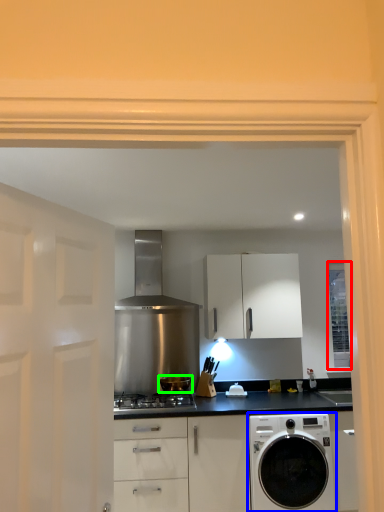
Question: Based on their relative distances, which object is farther from window (highlighted by a red box)? Choose from washing machine (highlighted by a blue box) and kitchen appliance (highlighted by a green box).

Choices:
 (A) washing machine
 (B) kitchen appliance

Answer: (B)